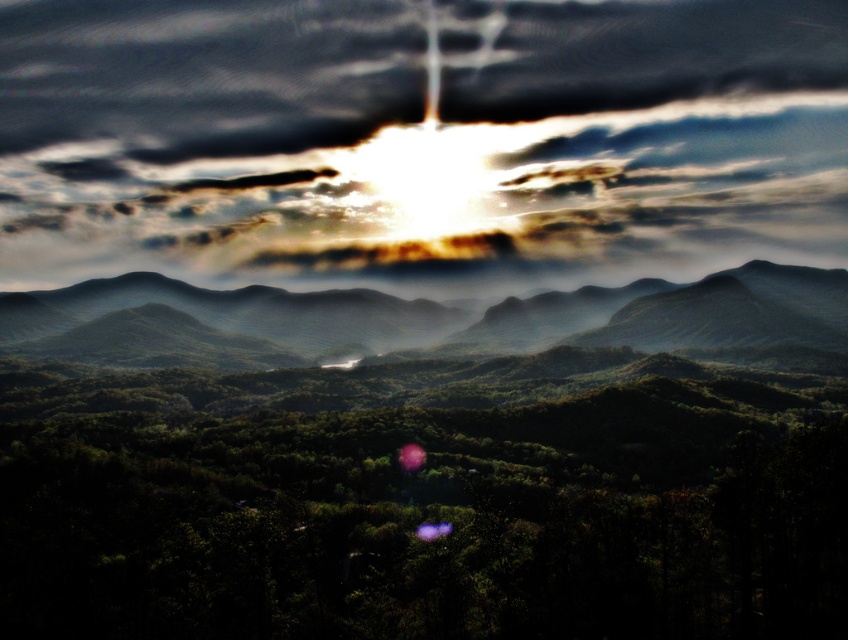
You are a photographer trying to capture the sunrise. You notice the cloudy sky at upper center and the smooth green mountains at center. Which object is positioned higher in the frame?

The cloudy sky at upper center is positioned higher in the frame than the smooth green mountains at center because it is much taller as described.